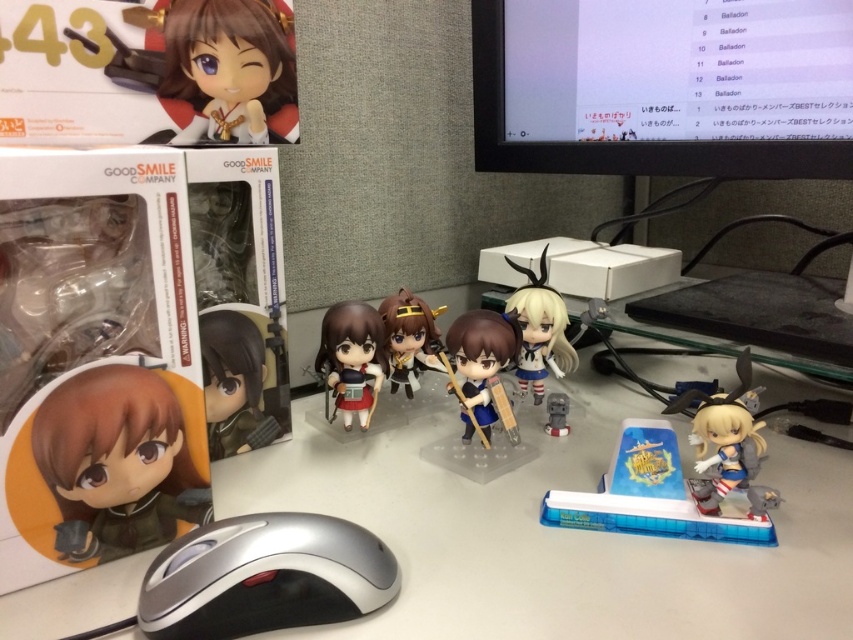
You are a delivery person who needs to place a new item on the desk. The item requires a space of 24 inches. You see the point at (834, 72). Can you fit the item between the two points without overlapping any existing items?

The two points are 24.45 inches apart, so yes, the item can fit between them as the required space is 24 inches.

You are organizing a display on the desk and need to place a new figurine between the matte brown figurine at center and the white matte figurine at center. The new figurine requires at least 4 inches of space to fit. Based on the current setup, will there be enough space?

The distance between the matte brown figurine at center and the white matte figurine at center is 3.38 inches. Since the required space is 4 inches, there is insufficient space to accommodate the new figurine.

You are organizing a display on a desk and need to place the matte plastic doll at upper left and the matte gray toy at center. Which object should you place first if you want to ensure proper visibility of both items?

You should place the matte plastic doll at upper left first because it is much taller than the matte gray toy at center. Positioning the taller item first allows you to arrange the shorter toy in a way that doesn